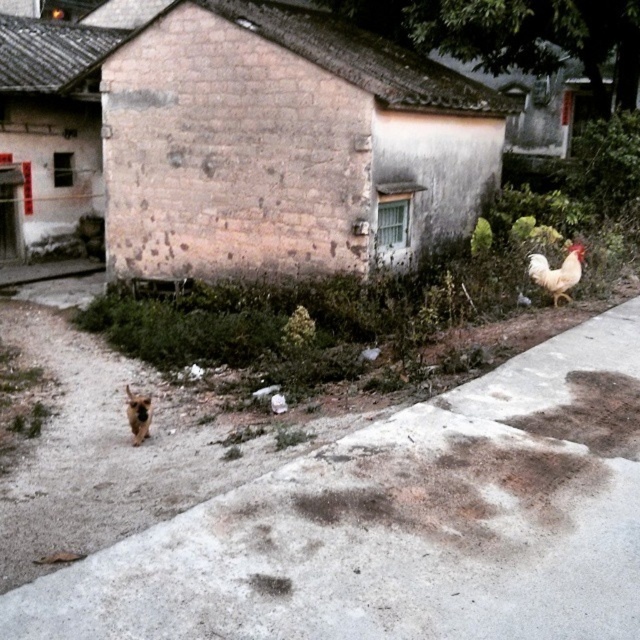
Question: Among these points, which one is farthest from the camera?

Choices:
 (A) (552, 275)
 (B) (134, 417)

Answer: (A)

Question: Is gray concrete pavement at lower right smaller than white feathered chicken at upper right?

Choices:
 (A) no
 (B) yes

Answer: (A)

Question: Is gray concrete pavement at lower right above brown furry dog at lower left?

Choices:
 (A) no
 (B) yes

Answer: (A)

Question: Which of the following is the farthest from the observer?

Choices:
 (A) [x=154, y=545]
 (B) [x=576, y=256]

Answer: (B)

Question: Estimate the real-world distances between objects in this image. Which object is closer to the gray concrete pavement at lower right?

Choices:
 (A) white feathered chicken at upper right
 (B) brown furry dog at lower left

Answer: (B)

Question: Does white feathered chicken at upper right have a larger size compared to brown furry dog at lower left?

Choices:
 (A) no
 (B) yes

Answer: (B)